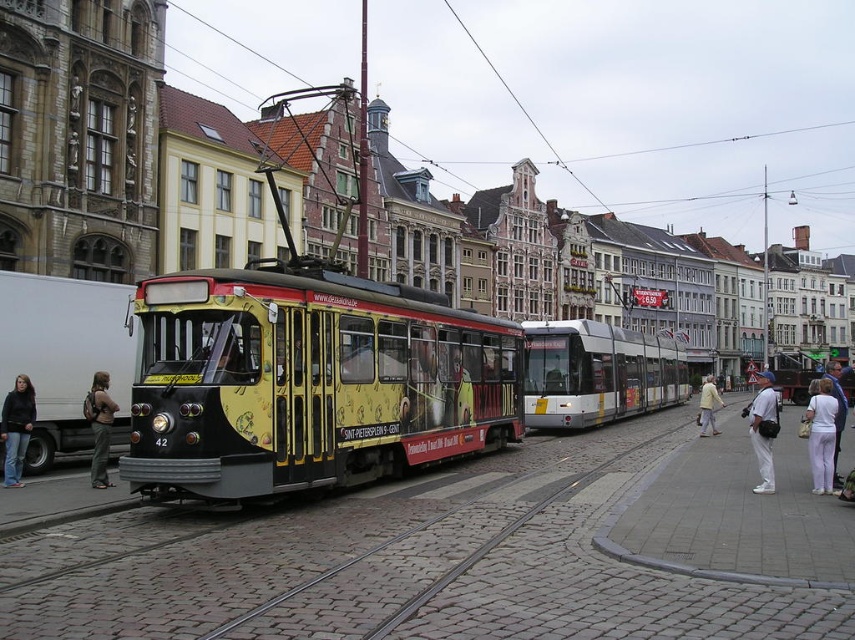
Question: Does light beige pants at lower right have a lesser width compared to dark gray backpack at left?

Choices:
 (A) no
 (B) yes

Answer: (A)

Question: Which of the following is the closest to the observer?

Choices:
 (A) (833, 449)
 (B) (770, 461)
 (C) (835, 371)
 (D) (108, 376)

Answer: (A)

Question: Which object is positioned closest to the white cotton shirt at lower right?

Choices:
 (A) white cotton shirt at center
 (B) dark gray backpack at left
 (C) light yellow jacket at center

Answer: (A)

Question: Which object is positioned farthest from the denim jacket at lower left?

Choices:
 (A) white cotton shirt at center
 (B) dark gray backpack at left
 (C) light beige pants at lower right

Answer: (C)

Question: Considering the relative positions of light beige pants at lower right and white cotton shirt at center in the image provided, where is light beige pants at lower right located with respect to white cotton shirt at center?

Choices:
 (A) below
 (B) above

Answer: (B)

Question: Can you confirm if denim jacket at lower left is positioned to the left of dark gray backpack at left?

Choices:
 (A) no
 (B) yes

Answer: (B)